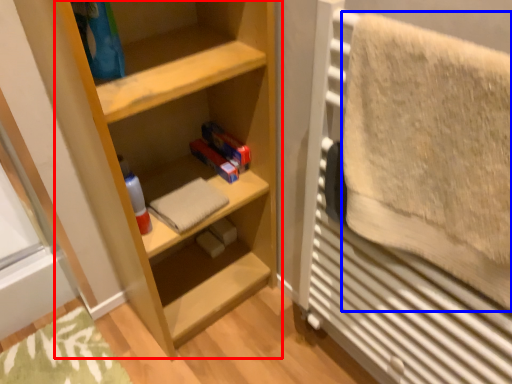
Question: Which point is further to the camera, shelf (highlighted by a red box) or bath towel (highlighted by a blue box)?

Choices:
 (A) shelf
 (B) bath towel

Answer: (A)